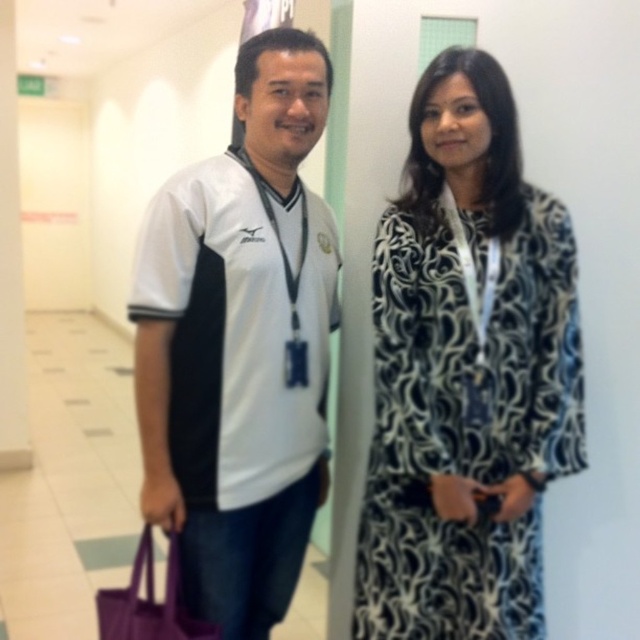
Question: Which point is closer to the camera?

Choices:
 (A) (195, 310)
 (B) (470, 541)
 (C) (572, 333)

Answer: (A)

Question: Which point is farther to the camera?

Choices:
 (A) (134, 570)
 (B) (204, 552)
 (C) (451, 301)
 (D) (570, 230)

Answer: (B)

Question: Can you confirm if white jersey at left is positioned below white jersey at center?

Choices:
 (A) no
 (B) yes

Answer: (B)

Question: Among these objects, which one is nearest to the camera?

Choices:
 (A) white jersey at center
 (B) purple fabric bag at lower left
 (C) black and white patterned dress at right
 (D) white jersey at left

Answer: (B)

Question: In this image, where is white jersey at center located relative to black and white patterned dress at right?

Choices:
 (A) above
 (B) below

Answer: (A)

Question: Is white jersey at center bigger than black and white patterned dress at right?

Choices:
 (A) yes
 (B) no

Answer: (A)